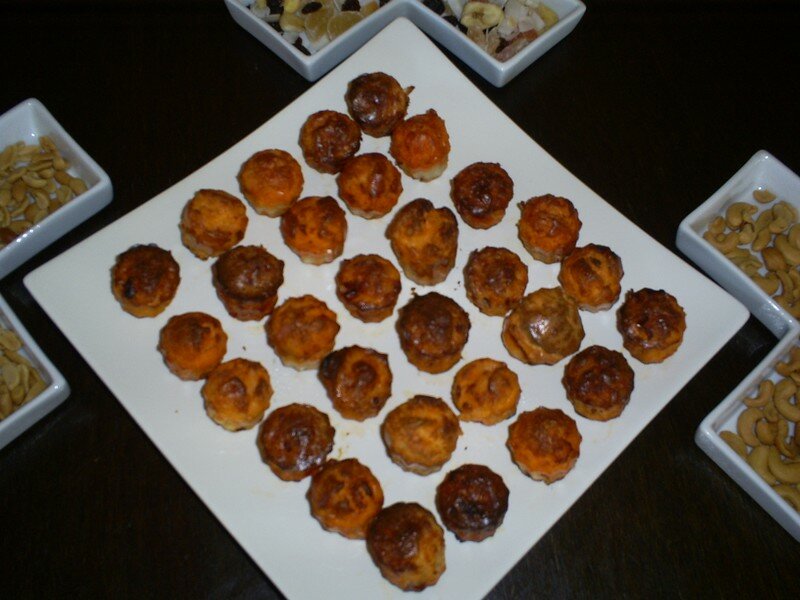
The height and width of the screenshot is (600, 800). I want to click on bowl of nuts on right, so click(x=789, y=330).